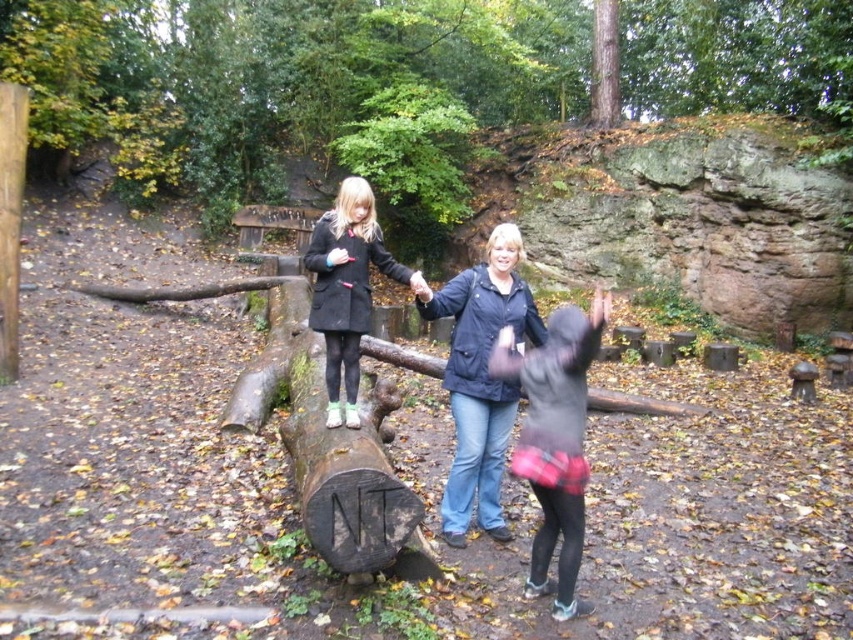
Based on the photo, does dark blue jacket at center appear over brown rough tree trunk at upper center?

Incorrect, dark blue jacket at center is not positioned above brown rough tree trunk at upper center.

Can you confirm if dark blue jacket at center is taller than brown rough tree trunk at upper center?

No.

Which is behind, point (527, 298) or point (605, 40)?

Positioned behind is point (605, 40).

In order to click on dark blue jacket at center in this screenshot , I will do `click(480, 380)`.

Is matte black coat at center smaller than brown rough tree trunk at upper center?

Indeed, matte black coat at center has a smaller size compared to brown rough tree trunk at upper center.

The image size is (853, 640). Describe the element at coordinates (347, 289) in the screenshot. I see `matte black coat at center` at that location.

Is point (341, 369) positioned behind point (593, 124)?

That is False.

I want to click on matte black coat at center, so click(347, 289).

Does dark blue jacket at center appear over black fuzzy jacket at center?

Correct, dark blue jacket at center is located above black fuzzy jacket at center.

Is dark blue jacket at center closer to the viewer compared to black fuzzy jacket at center?

No, dark blue jacket at center is behind black fuzzy jacket at center.

Identify the location of dark blue jacket at center. The height and width of the screenshot is (640, 853). (480, 380).